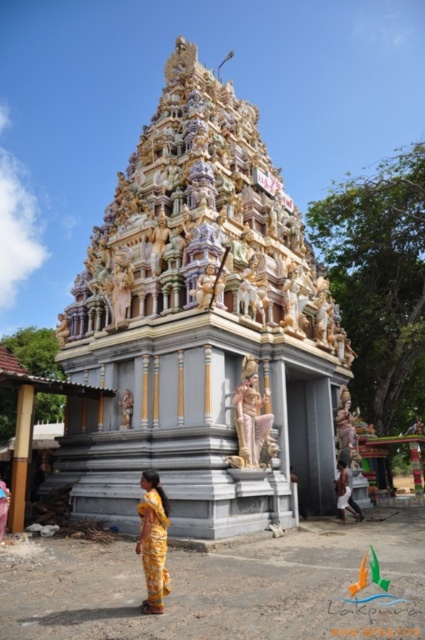
The height and width of the screenshot is (640, 425). In order to click on yellow printed sari at lower center in this screenshot , I will do `click(153, 540)`.

Does yellow printed sari at lower center lie behind yellow fabric dress at lower center?

That is False.

Does point (147, 561) lie behind point (342, 468)?

No, it is not.

I want to click on yellow printed sari at lower center, so click(x=153, y=540).

Locate an element on the screen. The height and width of the screenshot is (640, 425). polished stone temple at center is located at coordinates (201, 326).

Does polished stone temple at center appear on the left side of yellow printed sari at lower center?

No, polished stone temple at center is not to the left of yellow printed sari at lower center.

At what (x,y) coordinates should I click in order to perform the action: click on polished stone temple at center. Please return your answer as a coordinate pair (x, y). The height and width of the screenshot is (640, 425). Looking at the image, I should click on (201, 326).

Where is `polished stone temple at center`? The height and width of the screenshot is (640, 425). polished stone temple at center is located at coordinates (201, 326).

Can you confirm if polished stone temple at center is bigger than gold textured statue at center?

Yes, polished stone temple at center is bigger than gold textured statue at center.

Is polished stone temple at center thinner than gold textured statue at center?

No, polished stone temple at center is not thinner than gold textured statue at center.

Between point (178, 44) and point (249, 451), which one is positioned in front?

Positioned in front is point (249, 451).

Identify the location of polished stone temple at center. (201, 326).